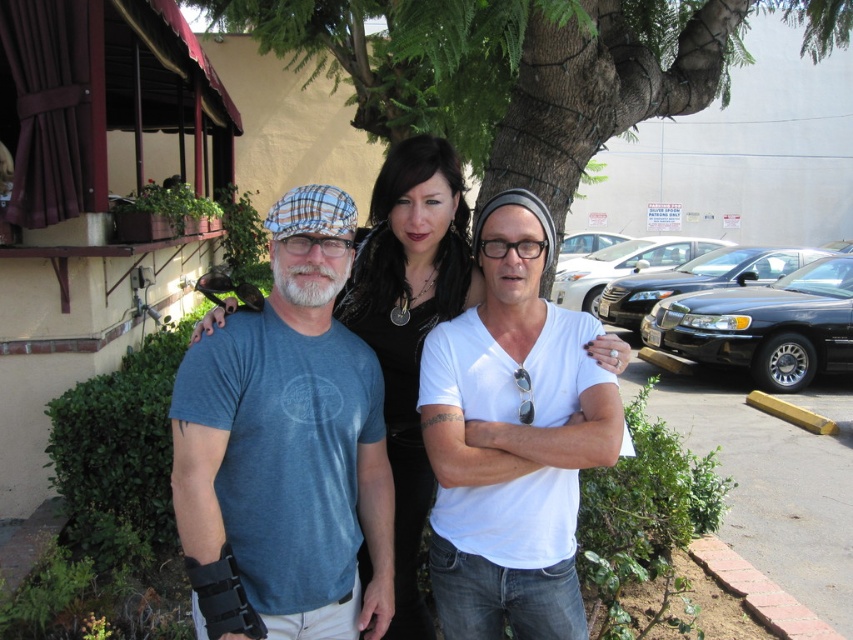
Is matte blue t-shirt at center taller than matte plaid goggles at center?

Yes, matte blue t-shirt at center is taller than matte plaid goggles at center.

Is matte blue t-shirt at center shorter than matte plaid goggles at center?

No.

Between point (363, 228) and point (308, 243), which one is positioned in front?

Point (308, 243) is in front.

Identify the location of matte blue t-shirt at center. The width and height of the screenshot is (853, 640). (410, 324).

Who is taller, white cotton shirt at center or transparent plastic glasses at center?

Standing taller between the two is white cotton shirt at center.

Which is more to the left, white cotton shirt at center or transparent plastic glasses at center?

transparent plastic glasses at center

Where is `white cotton shirt at center`? The width and height of the screenshot is (853, 640). white cotton shirt at center is located at coordinates click(512, 442).

Does white cotton shirt at center appear on the right side of matte plaid goggles at center?

Indeed, white cotton shirt at center is positioned on the right side of matte plaid goggles at center.

Between point (543, 506) and point (325, 243), which one is positioned behind?

Positioned behind is point (543, 506).

Find the location of a particular element. white cotton shirt at center is located at coordinates (512, 442).